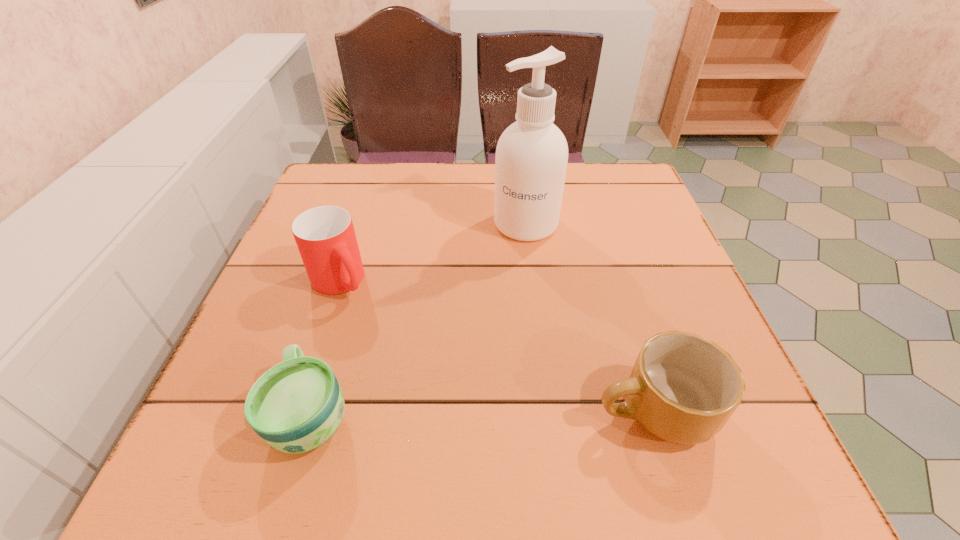
Where is `object that is at the near left corner`? The image size is (960, 540). object that is at the near left corner is located at coordinates click(296, 406).

Locate an element on the screen. Image resolution: width=960 pixels, height=540 pixels. object that is at the near right corner is located at coordinates (683, 388).

Identify the location of vacant space at the far edge of the desktop. The width and height of the screenshot is (960, 540). (437, 174).

The image size is (960, 540). Identify the location of free space at the near edge of the desktop. (597, 385).

Where is `blank area at the left edge`? The width and height of the screenshot is (960, 540). blank area at the left edge is located at coordinates (264, 308).

This screenshot has width=960, height=540. What are the coordinates of `free space at the right edge of the desktop` in the screenshot? It's located at (612, 248).

What are the coordinates of `vacant area at the far left corner` in the screenshot? It's located at (310, 205).

Find the location of a particular element. This screenshot has height=540, width=960. free space at the near left corner is located at coordinates (229, 413).

This screenshot has width=960, height=540. In the image, there is a desktop. Find the location of `vacant space at the far right corner`. vacant space at the far right corner is located at coordinates (627, 194).

Locate an element on the screen. This screenshot has height=540, width=960. free space between the third shortest object and the tallest object is located at coordinates (433, 252).